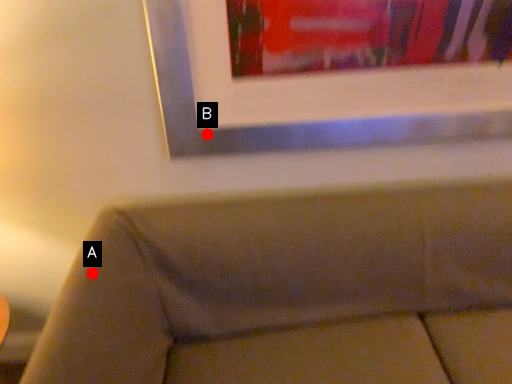
Question: Two points are circled on the image, labeled by A and B beside each circle. Among these points, which one is farthest from the camera?

Choices:
 (A) A is further
 (B) B is further

Answer: (B)